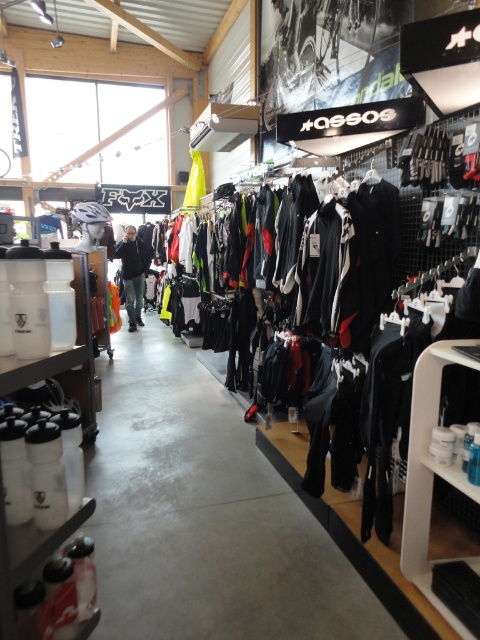
Between white plastic bottles at lower right and dark gray jacket at center, which one is positioned lower?

Positioned lower is white plastic bottles at lower right.

Looking at this image, who is more forward, (x=429, y=458) or (x=135, y=266)?

Point (x=429, y=458) is more forward.

The image size is (480, 640). I want to click on white plastic bottles at lower right, so click(x=430, y=472).